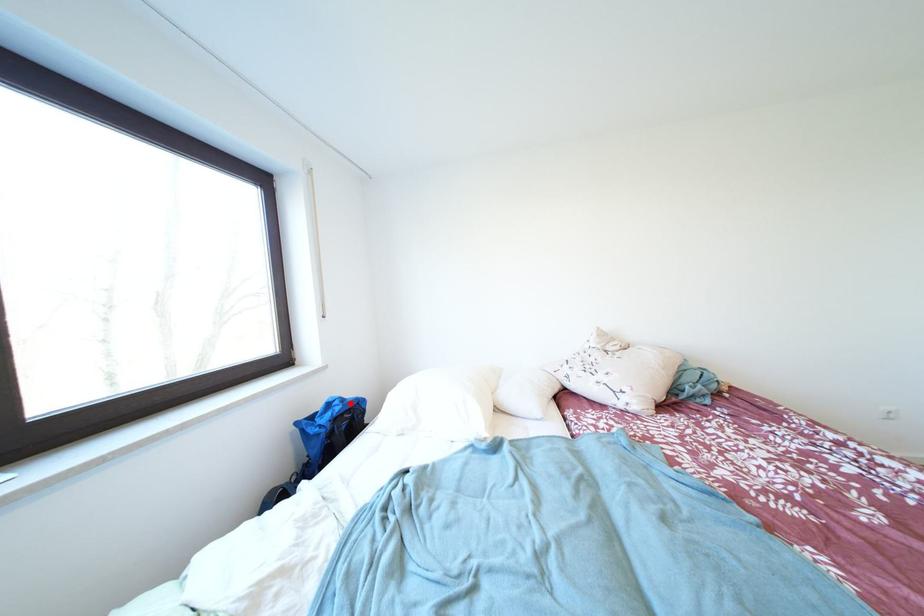
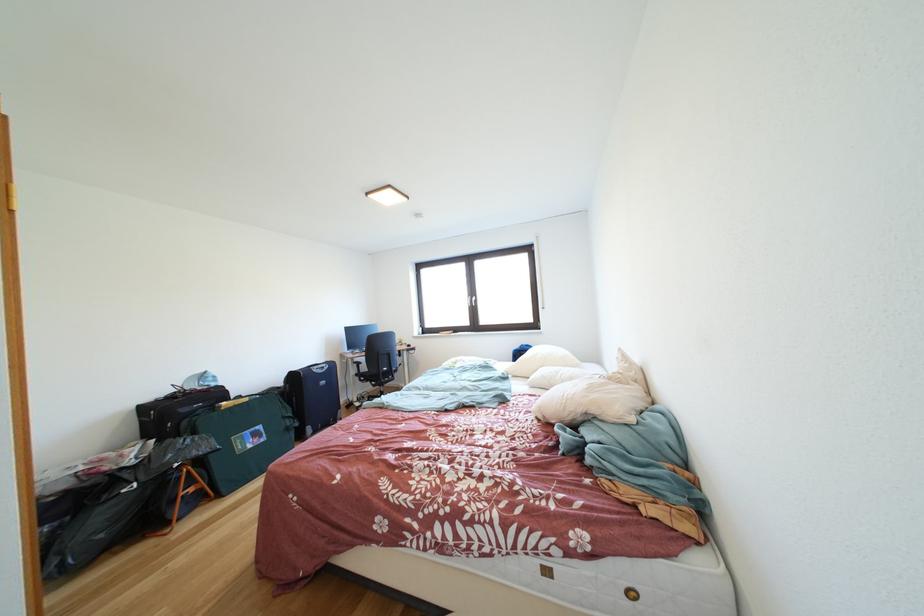
Locate, in the second image, the point that corresponds to the highlighted location in the first image.

(535, 351)